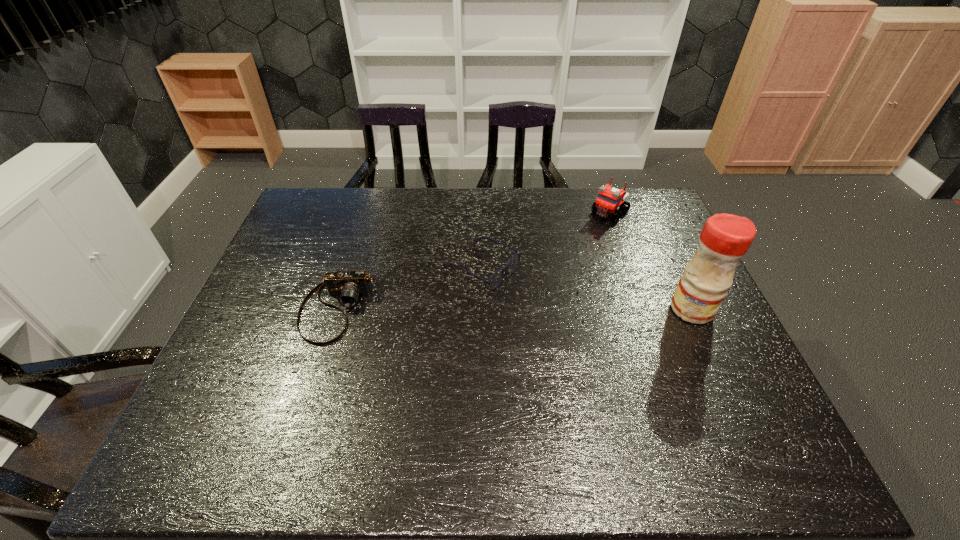
The width and height of the screenshot is (960, 540). In order to click on free spot on the desktop that is between the camera and the tallest object and is positioned on the front-facing side of the second tallest object in this screenshot , I will do `click(505, 309)`.

This screenshot has width=960, height=540. I want to click on vacant space on the desktop that is between the camera and the tallest object and is positioned on the front-facing side of the second object from left to right, so coord(561,309).